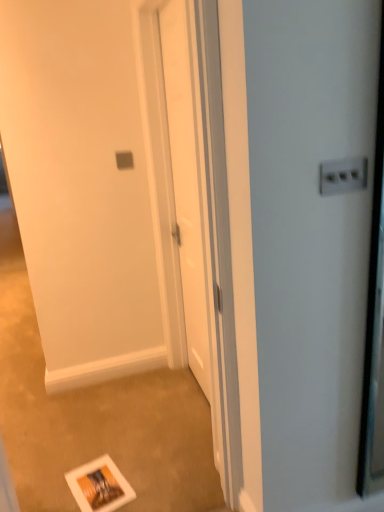
The image size is (384, 512). What are the coordinates of `white plastic electric outlet at upper right` in the screenshot? It's located at (343, 176).

This screenshot has width=384, height=512. Describe the element at coordinates (99, 486) in the screenshot. I see `white matte postcard at lower center` at that location.

Locate an element on the screen. This screenshot has width=384, height=512. white matte postcard at lower center is located at coordinates (99, 486).

You are a GUI agent. You are given a task and a screenshot of the screen. Output one action in this format:
    pyautogui.click(x=<x>, y=<y>)
    Task: Click on the white glossy door at center, positioned as the 2th screen door in front-to-back order
    Image resolution: width=384 pixels, height=512 pixels.
    Given the screenshot: What is the action you would take?
    pyautogui.click(x=192, y=207)

At what (x,y) coordinates should I click in order to perform the action: click on white plastic electric outlet at upper right. Please return your answer as a coordinate pair (x, y). Image resolution: width=384 pixels, height=512 pixels. Looking at the image, I should click on (343, 176).

From the image's perspective, is white glossy screen door at lower center, which appears as the first screen door when viewed from the front, beneath white matte postcard at lower center?

No, from the image's perspective, white glossy screen door at lower center, which appears as the first screen door when viewed from the front, is not beneath white matte postcard at lower center.

From a real-world perspective, is white glossy screen door at lower center, the 2th screen door in the back-to-front sequence, located beneath white matte postcard at lower center?

Incorrect, from a real-world perspective, white glossy screen door at lower center, the 2th screen door in the back-to-front sequence, is higher than white matte postcard at lower center.

Which object is positioned more to the left, white glossy screen door at lower center, the 2th screen door in the back-to-front sequence, or white matte postcard at lower center?

From the viewer's perspective, white matte postcard at lower center appears more on the left side.

Considering the sizes of objects white glossy screen door at lower center, which appears as the first screen door when viewed from the front, and white matte postcard at lower center in the image provided, who is taller, white glossy screen door at lower center, which appears as the first screen door when viewed from the front, or white matte postcard at lower center?

white glossy screen door at lower center, which appears as the first screen door when viewed from the front, is taller.

Considering the positions of objects white plastic electric outlet at upper right and white glossy door at center, which is the 1th screen door in back-to-front order, in the image provided, who is behind, white plastic electric outlet at upper right or white glossy door at center, which is the 1th screen door in back-to-front order,?

white plastic electric outlet at upper right is more distant.

Does white plastic electric outlet at upper right turn towards white glossy door at center, positioned as the 2th screen door in front-to-back order?

No, white plastic electric outlet at upper right is not oriented towards white glossy door at center, positioned as the 2th screen door in front-to-back order.

Is white plastic electric outlet at upper right wider or thinner than white glossy door at center, which is the 1th screen door in back-to-front order?

Clearly, white plastic electric outlet at upper right has less width compared to white glossy door at center, which is the 1th screen door in back-to-front order.

From the image's perspective, which object appears higher, white matte postcard at lower center or white plastic electric outlet at upper right?

From the image's view, white plastic electric outlet at upper right is above.

What are the coordinates of `postcard located below the white plastic electric outlet at upper right (from the image's perspective)` in the screenshot? It's located at (99, 486).

Which object is further away from the camera taking this photo, white matte postcard at lower center or white plastic electric outlet at upper right?

white matte postcard at lower center is more distant.

Between point (115, 481) and point (348, 191), which one is positioned in front?

The point (348, 191) is closer to the camera.

How many degrees apart are the facing directions of white matte postcard at lower center and white glossy screen door at lower center, which appears as the first screen door when viewed from the front?

The angle between the facing direction of white matte postcard at lower center and the facing direction of white glossy screen door at lower center, which appears as the first screen door when viewed from the front, is 17.8 degrees.

Is white matte postcard at lower center at the right side of white glossy screen door at lower center, which appears as the first screen door when viewed from the front?

In fact, white matte postcard at lower center is to the left of white glossy screen door at lower center, which appears as the first screen door when viewed from the front.

From a real-world perspective, who is located lower, white matte postcard at lower center or white glossy screen door at lower center, the 2th screen door in the back-to-front sequence?

white matte postcard at lower center is physically lower.

Is point (80, 490) more distant than point (112, 67)?

No, it is not.

In the image, is white matte postcard at lower center on the left side or the right side of white glossy door at center, which is the 1th screen door in back-to-front order?

Clearly, white matte postcard at lower center is on the left of white glossy door at center, which is the 1th screen door in back-to-front order, in the image.

Does white matte postcard at lower center have a larger size compared to white glossy door at center, which is the 1th screen door in back-to-front order?

Incorrect, white matte postcard at lower center is not larger than white glossy door at center, which is the 1th screen door in back-to-front order.

Is point (95, 489) positioned before point (187, 197)?

Yes, point (95, 489) is closer to viewer.

Do you think white matte postcard at lower center is within white glossy door at center, which is the 1th screen door in back-to-front order, or outside of it?

white matte postcard at lower center lies outside white glossy door at center, which is the 1th screen door in back-to-front order.

Is white glossy screen door at lower center, which appears as the first screen door when viewed from the front, to the left or to the right of white glossy door at center, which is the 1th screen door in back-to-front order, in the image?

In the image, white glossy screen door at lower center, which appears as the first screen door when viewed from the front, appears on the left side of white glossy door at center, which is the 1th screen door in back-to-front order.

Which is nearer, (112, 236) or (223, 401)?

Point (112, 236) is positioned farther from the camera compared to point (223, 401).

Consider the image. Considering their positions, is white glossy screen door at lower center, which appears as the first screen door when viewed from the front, located in front of or behind white glossy door at center, positioned as the 2th screen door in front-to-back order?

white glossy screen door at lower center, which appears as the first screen door when viewed from the front, is positioned closer to the viewer than white glossy door at center, positioned as the 2th screen door in front-to-back order.

Which of these two, white glossy screen door at lower center, the 2th screen door in the back-to-front sequence, or white glossy door at center, which is the 1th screen door in back-to-front order, stands taller?

white glossy door at center, which is the 1th screen door in back-to-front order, is taller.

Can you see white plastic electric outlet at upper right touching white matte postcard at lower center?

They are not placed beside each other.

From a real-world perspective, is white plastic electric outlet at upper right physically above white matte postcard at lower center?

Correct, in the physical world, white plastic electric outlet at upper right is higher than white matte postcard at lower center.

Is white plastic electric outlet at upper right facing away from white matte postcard at lower center?

No, white matte postcard at lower center is not at the back of white plastic electric outlet at upper right.

Considering the relative sizes of white plastic electric outlet at upper right and white matte postcard at lower center in the image provided, is white plastic electric outlet at upper right thinner than white matte postcard at lower center?

Yes, white plastic electric outlet at upper right is thinner than white matte postcard at lower center.

Which screen door is the 1st one when counting from the right side of the white matte postcard at lower center? Please provide its 2D coordinates.

[(93, 184)]

Where is `screen door that is the 1st one below the white plastic electric outlet at upper right (from a real-world perspective)`? The image size is (384, 512). screen door that is the 1st one below the white plastic electric outlet at upper right (from a real-world perspective) is located at coordinates (192, 207).

Estimate the real-world distances between objects in this image. Which object is closer to white matte postcard at lower center, white plastic electric outlet at upper right or white glossy screen door at lower center, the 2th screen door in the back-to-front sequence?

Based on the image, white glossy screen door at lower center, the 2th screen door in the back-to-front sequence, appears to be nearer to white matte postcard at lower center.

Based on their spatial positions, is white glossy door at center, positioned as the 2th screen door in front-to-back order, or white plastic electric outlet at upper right further from white matte postcard at lower center?

Based on the image, white plastic electric outlet at upper right appears to be further to white matte postcard at lower center.

Considering their positions, is white plastic electric outlet at upper right positioned closer to white glossy screen door at lower center, the 2th screen door in the back-to-front sequence, than white matte postcard at lower center?

Among the two, white matte postcard at lower center is located nearer to white glossy screen door at lower center, the 2th screen door in the back-to-front sequence.

Considering their positions, is white glossy screen door at lower center, the 2th screen door in the back-to-front sequence, positioned further to white matte postcard at lower center than white plastic electric outlet at upper right?

white plastic electric outlet at upper right.

Looking at the image, which one is located closer to white plastic electric outlet at upper right, white glossy screen door at lower center, which appears as the first screen door when viewed from the front, or white matte postcard at lower center?

The object closer to white plastic electric outlet at upper right is white matte postcard at lower center.

From the image, which object appears to be farther from white glossy screen door at lower center, which appears as the first screen door when viewed from the front, white glossy door at center, which is the 1th screen door in back-to-front order, or white plastic electric outlet at upper right?

white plastic electric outlet at upper right.

From the image, which object appears to be farther from white plastic electric outlet at upper right, white matte postcard at lower center or white glossy screen door at lower center, which appears as the first screen door when viewed from the front?

white glossy screen door at lower center, which appears as the first screen door when viewed from the front.

From the picture: Considering their positions, is white glossy screen door at lower center, the 2th screen door in the back-to-front sequence, positioned closer to white plastic electric outlet at upper right than white glossy door at center, positioned as the 2th screen door in front-to-back order?

The object closer to white plastic electric outlet at upper right is white glossy door at center, positioned as the 2th screen door in front-to-back order.

Where is `screen door that lies between white glossy door at center, which is the 1th screen door in back-to-front order, and white matte postcard at lower center from top to bottom`? This screenshot has width=384, height=512. screen door that lies between white glossy door at center, which is the 1th screen door in back-to-front order, and white matte postcard at lower center from top to bottom is located at coordinates (93, 184).

Where is `screen door situated between white glossy screen door at lower center, which appears as the first screen door when viewed from the front, and white plastic electric outlet at upper right from left to right`? This screenshot has width=384, height=512. screen door situated between white glossy screen door at lower center, which appears as the first screen door when viewed from the front, and white plastic electric outlet at upper right from left to right is located at coordinates (192, 207).